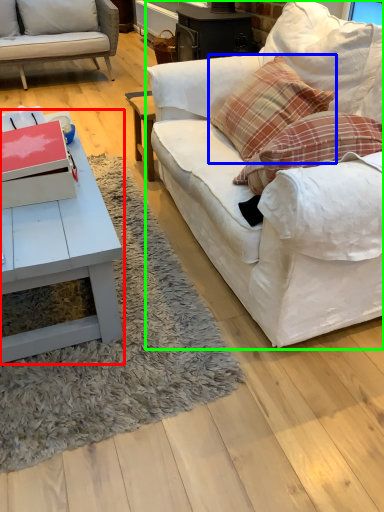
Question: Which object is the farthest from coffee table (highlighted by a red box)? Choose among these: pillow (highlighted by a blue box) or studio couch (highlighted by a green box).

Choices:
 (A) pillow
 (B) studio couch

Answer: (A)